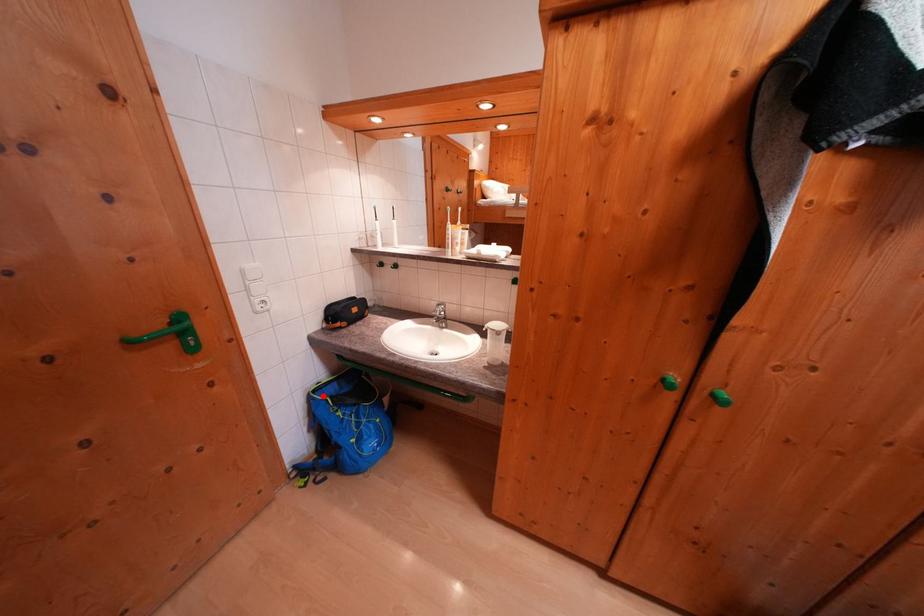
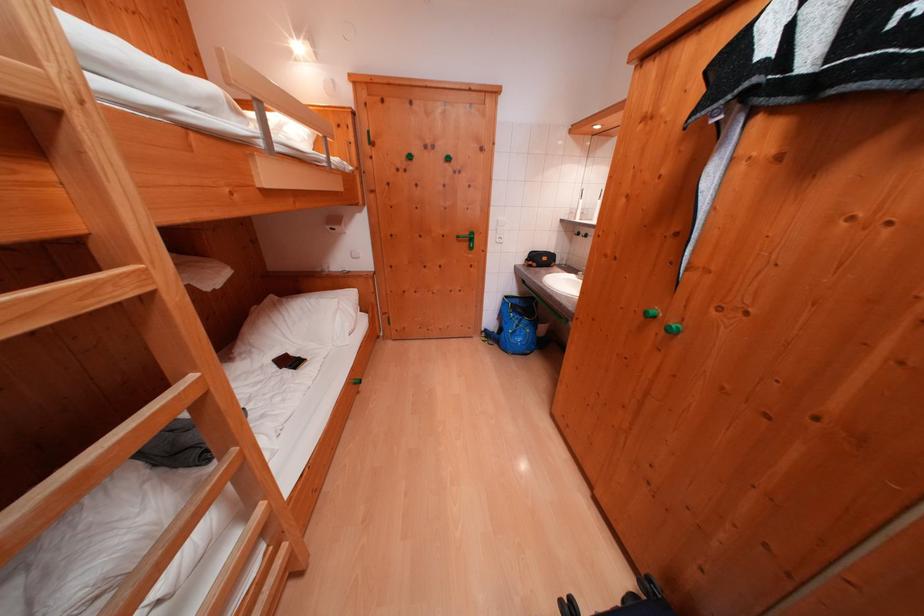
The point at the highlighted location is marked in the first image. Where is the corresponding point in the second image?

(515, 301)